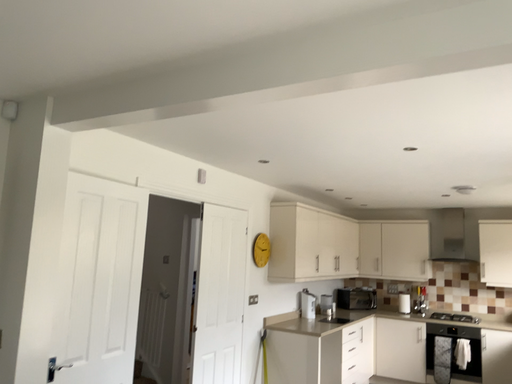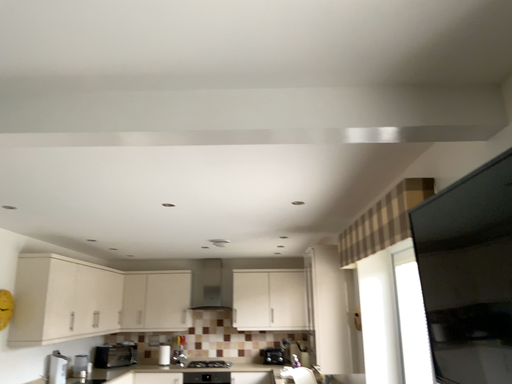
Question: Which way did the camera rotate in the video?

Choices:
 (A) rotated right
 (B) rotated left

Answer: (A)